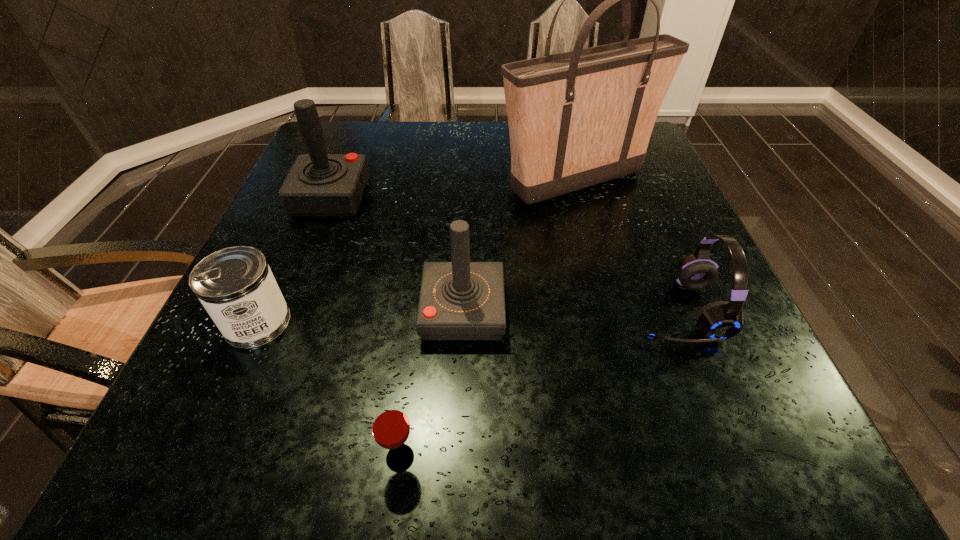
I want to click on the tallest object, so click(x=576, y=119).

Locate an element on the screen. the left joystick is located at coordinates (319, 184).

Locate an element on the screen. Image resolution: width=960 pixels, height=540 pixels. the fourth shortest object is located at coordinates (460, 300).

You are a GUI agent. You are given a task and a screenshot of the screen. Output one action in this format:
    pyautogui.click(x=<x>, y=<y>)
    Task: Click on the shorter joystick
    
    Given the screenshot: What is the action you would take?
    pyautogui.click(x=460, y=300)

Locate an element on the screen. The width and height of the screenshot is (960, 540). the third shortest object is located at coordinates (721, 320).

Where is `can`? This screenshot has width=960, height=540. can is located at coordinates (235, 285).

The image size is (960, 540). In order to click on glass in this screenshot , I will do `click(390, 426)`.

In order to click on vacant space situated 0.360m on the front of the tallest object in this screenshot , I will do `click(619, 340)`.

Image resolution: width=960 pixels, height=540 pixels. What are the coordinates of `vacant point located on the base of the farther joystick` in the screenshot? It's located at (504, 198).

Find the location of a particular element. Image resolution: width=960 pixels, height=540 pixels. free region located on the rectangular base of the fourth shortest object is located at coordinates (694, 311).